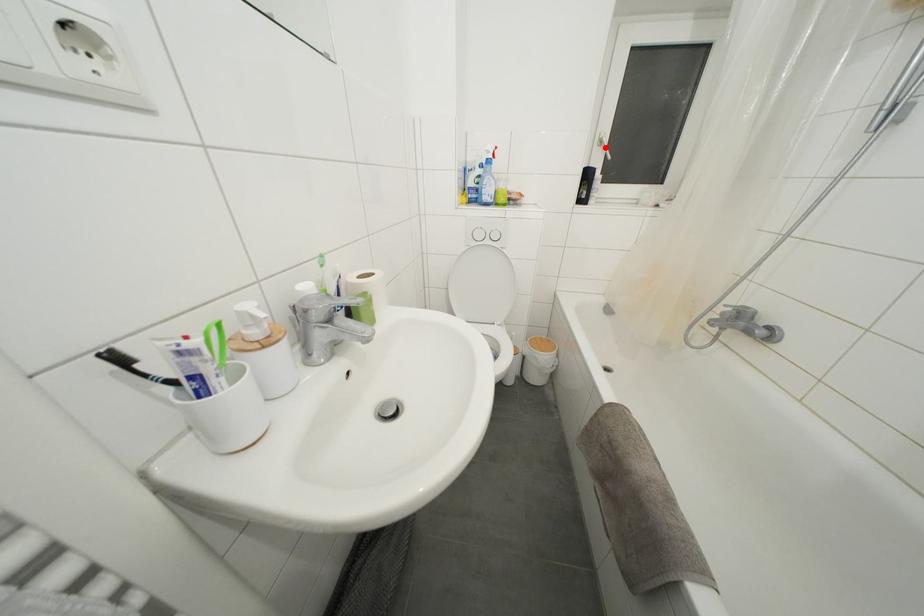
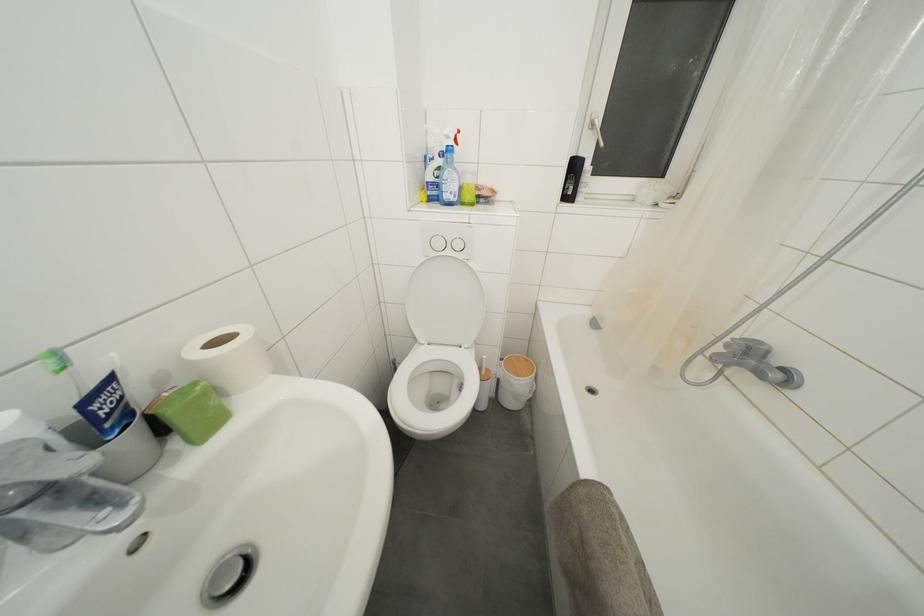
Locate, in the second image, the point that corresponds to the highlighted location in the first image.

(597, 131)